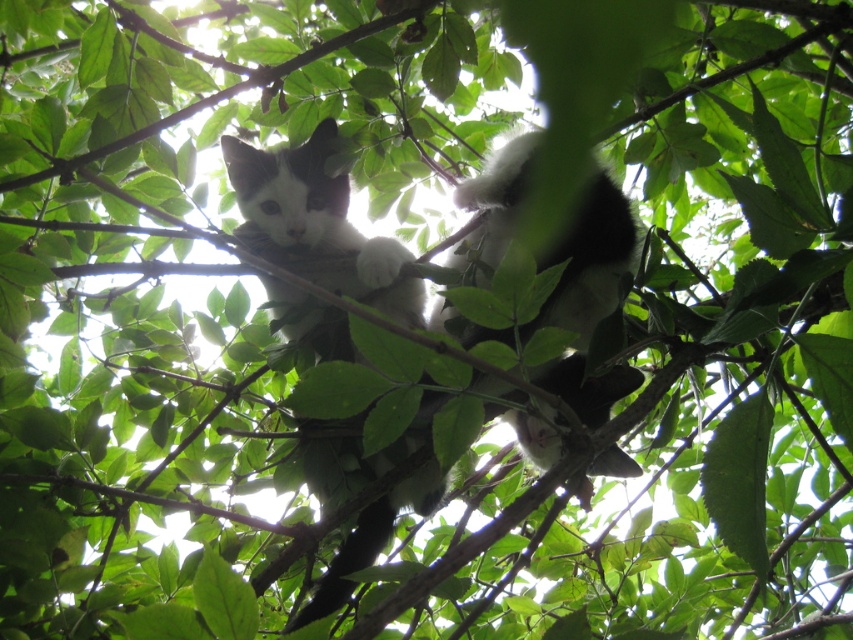
Does black and white fur cat at center appear over white fluffy cat at center?

No, black and white fur cat at center is not above white fluffy cat at center.

Can you confirm if black and white fur cat at center is bigger than white fluffy cat at center?

Correct, black and white fur cat at center is larger in size than white fluffy cat at center.

Between point (590, 289) and point (306, 195), which one is positioned in front?

Point (590, 289)

This screenshot has height=640, width=853. Find the location of `black and white fur cat at center`. black and white fur cat at center is located at coordinates (585, 291).